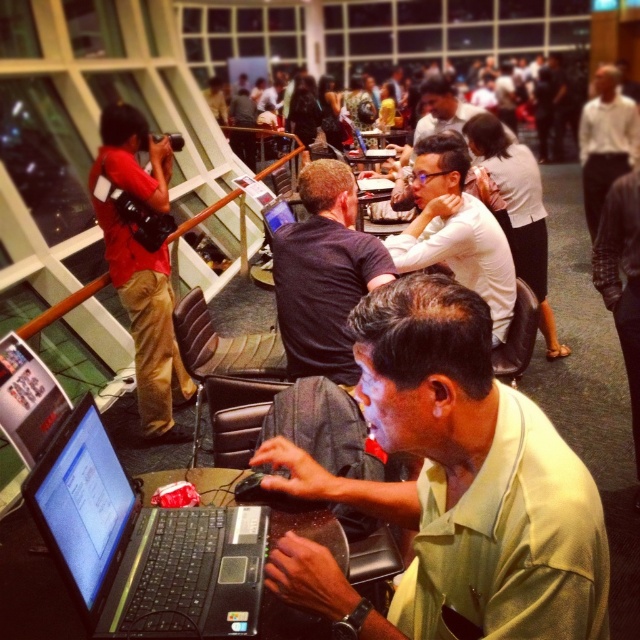
Consider the image. You are organizing a seating arrangement and need to place a chair next to the light green shirt at center. Considering the space taken by the black plastic laptop at lower left, will there be enough room for the chair?

The light green shirt at center might be wider than the black plastic laptop at lower left, so there may not be enough space for the chair.